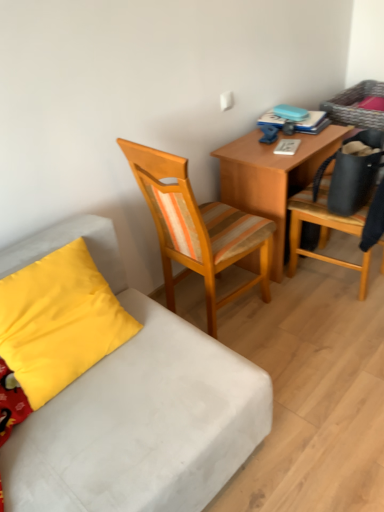
Question: Does white fabric studio couch at lower left turn towards wooden chair at right, the first chair positioned from the right?

Choices:
 (A) no
 (B) yes

Answer: (A)

Question: From a real-world perspective, is white fabric studio couch at lower left physically above wooden chair at right, the second chair viewed from the left?

Choices:
 (A) yes
 (B) no

Answer: (B)

Question: From the image's perspective, would you say white fabric studio couch at lower left is positioned over wooden chair at right, the first chair positioned from the right?

Choices:
 (A) yes
 (B) no

Answer: (B)

Question: From a real-world perspective, is white fabric studio couch at lower left below wooden chair at right, the first chair positioned from the right?

Choices:
 (A) yes
 (B) no

Answer: (A)

Question: Is white fabric studio couch at lower left placed right next to wooden chair at right, the first chair positioned from the right?

Choices:
 (A) yes
 (B) no

Answer: (B)

Question: In terms of size, does wooden desk at center appear bigger or smaller than yellow fabric pillow at lower left?

Choices:
 (A) small
 (B) big

Answer: (B)

Question: Is point (223, 201) positioned closer to the camera than point (89, 295)?

Choices:
 (A) closer
 (B) farther

Answer: (B)

Question: From the image's perspective, is wooden desk at center above or below yellow fabric pillow at lower left?

Choices:
 (A) below
 (B) above

Answer: (B)

Question: Relative to yellow fabric pillow at lower left, is wooden desk at center in front or behind?

Choices:
 (A) front
 (B) behind

Answer: (B)

Question: Is point (23, 333) positioned closer to the camera than point (258, 221)?

Choices:
 (A) closer
 (B) farther

Answer: (A)

Question: Is yellow fabric pillow at lower left in front of or behind woodenchair at center, positioned as the second chair in right-to-left order, in the image?

Choices:
 (A) behind
 (B) front

Answer: (B)

Question: From the image's perspective, is yellow fabric pillow at lower left positioned above or below woodenchair at center, positioned as the second chair in right-to-left order?

Choices:
 (A) below
 (B) above

Answer: (A)

Question: Considering the positions of yellow fabric pillow at lower left and woodenchair at center, the first chair positioned from the left, in the image, is yellow fabric pillow at lower left wider or thinner than woodenchair at center, the first chair positioned from the left,?

Choices:
 (A) thin
 (B) wide

Answer: (A)

Question: In the image, is wooden desk at center on the left side or the right side of white fabric studio couch at lower left?

Choices:
 (A) left
 (B) right

Answer: (B)

Question: Does point (274, 174) appear closer or farther from the camera than point (76, 437)?

Choices:
 (A) closer
 (B) farther

Answer: (B)